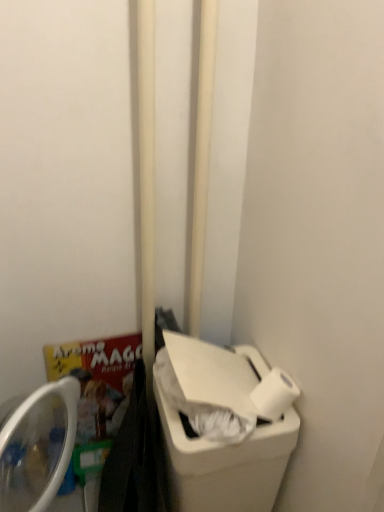
This screenshot has width=384, height=512. Describe the element at coordinates (147, 177) in the screenshot. I see `white smooth pole at center, positioned as the second pole in right-to-left order` at that location.

Consider the image. What is the approximate height of white plastic recycling bin at lower right?

The height of white plastic recycling bin at lower right is 22.57 inches.

Identify the location of white matte toilet paper at lower right. This screenshot has width=384, height=512. (274, 394).

At what (x,y) coordinates should I click in order to perform the action: click on recycling bin that is on the right side of white smooth pole at center, positioned as the second pole in right-to-left order. Please return your answer as a coordinate pair (x, y). The height and width of the screenshot is (512, 384). Looking at the image, I should click on (226, 464).

Who is smaller, white smooth pole at center, positioned as the second pole in right-to-left order, or white plastic recycling bin at lower right?

white smooth pole at center, positioned as the second pole in right-to-left order.

From a real-world perspective, which object rests below the other?

In real-world perspective, white plastic recycling bin at lower right is lower.

Is white smooth pole at center, the first pole in the left-to-right sequence, positioned behind white plastic recycling bin at lower right?

No, white smooth pole at center, the first pole in the left-to-right sequence, is closer to the viewer.

Is white plastic recycling bin at lower right positioned with its back to white smooth pole at center, the first pole in the left-to-right sequence?

No, white smooth pole at center, the first pole in the left-to-right sequence, is not at the back of white plastic recycling bin at lower right.

From the image's perspective, is white plastic recycling bin at lower right under white smooth pole at center, positioned as the second pole in right-to-left order?

Yes, from the image's perspective, white plastic recycling bin at lower right is beneath white smooth pole at center, positioned as the second pole in right-to-left order.

Which object is thinner, white plastic recycling bin at lower right or white smooth pole at center, the first pole in the left-to-right sequence?

Thinner between the two is white smooth pole at center, the first pole in the left-to-right sequence.

From a real-world perspective, is white matte toilet paper at lower right physically located above or below white smooth pole at center, positioned as the second pole in right-to-left order?

Clearly, from a real-world perspective, white matte toilet paper at lower right is below white smooth pole at center, positioned as the second pole in right-to-left order.

From the picture: Is white matte toilet paper at lower right next to white smooth pole at center, the first pole in the left-to-right sequence?

No, white matte toilet paper at lower right is not touching white smooth pole at center, the first pole in the left-to-right sequence.

In terms of width, does white matte toilet paper at lower right look wider or thinner when compared to white smooth pole at center, positioned as the second pole in right-to-left order?

white matte toilet paper at lower right is thinner than white smooth pole at center, positioned as the second pole in right-to-left order.

Consider the image. Can you tell me how much white matte toilet paper at lower right and white smooth pole at center, positioned as the second pole in right-to-left order, differ in facing direction?

white matte toilet paper at lower right and white smooth pole at center, positioned as the second pole in right-to-left order, are facing 90 degrees away from each other.

Which point is more forward, (147, 295) or (194, 334)?

The point (147, 295) is in front.

Where is `pole that is above the white smooth pole at center, positioned as the second pole in right-to-left order (from the image's perspective)`? The width and height of the screenshot is (384, 512). pole that is above the white smooth pole at center, positioned as the second pole in right-to-left order (from the image's perspective) is located at coordinates (202, 158).

Considering the sizes of white smooth pole at center, the first pole in the left-to-right sequence, and white smooth pole at center, marked as the second pole in a left-to-right arrangement, in the image, is white smooth pole at center, the first pole in the left-to-right sequence, bigger or smaller than white smooth pole at center, marked as the second pole in a left-to-right arrangement,?

In the image, white smooth pole at center, the first pole in the left-to-right sequence, appears to be larger than white smooth pole at center, marked as the second pole in a left-to-right arrangement.

Which is nearer, (193, 298) or (150, 78)?

The point (150, 78) is in front.

Based on the photo, is white smooth pole at center, placed as the first pole when sorted from right to left, thinner than white smooth pole at center, positioned as the second pole in right-to-left order?

Yes.

Considering the relative sizes of white smooth pole at center, marked as the second pole in a left-to-right arrangement, and white smooth pole at center, the first pole in the left-to-right sequence, in the image provided, is white smooth pole at center, marked as the second pole in a left-to-right arrangement, taller than white smooth pole at center, the first pole in the left-to-right sequence,?

No.

Is white smooth pole at center, placed as the first pole when sorted from right to left, at the right side of white smooth pole at center, the first pole in the left-to-right sequence?

Yes.

Considering the positions of objects white plastic recycling bin at lower right and white smooth pole at center, marked as the second pole in a left-to-right arrangement, in the image provided, who is behind, white plastic recycling bin at lower right or white smooth pole at center, marked as the second pole in a left-to-right arrangement,?

Positioned behind is white smooth pole at center, marked as the second pole in a left-to-right arrangement.

Is white plastic recycling bin at lower right positioned far away from white smooth pole at center, placed as the first pole when sorted from right to left?

No, white plastic recycling bin at lower right is not far away from white smooth pole at center, placed as the first pole when sorted from right to left.

Locate an element on the screen. This screenshot has width=384, height=512. pole that is the 1st one when counting leftward from the white plastic recycling bin at lower right is located at coordinates [x=202, y=158].

Which object is wider, white matte toilet paper at lower right or white smooth pole at center, marked as the second pole in a left-to-right arrangement?

white matte toilet paper at lower right is wider.

Is white matte toilet paper at lower right bigger than white smooth pole at center, marked as the second pole in a left-to-right arrangement?

No.

Is white matte toilet paper at lower right not close to white smooth pole at center, marked as the second pole in a left-to-right arrangement?

No, there isn't a large distance between white matte toilet paper at lower right and white smooth pole at center, marked as the second pole in a left-to-right arrangement.

This screenshot has height=512, width=384. Identify the location of the 2nd pole to the left of the white plastic recycling bin at lower right, counting from the anchor's position. (147, 177).

Where is `recycling bin below the white smooth pole at center, the first pole in the left-to-right sequence (from the image's perspective)`? Image resolution: width=384 pixels, height=512 pixels. recycling bin below the white smooth pole at center, the first pole in the left-to-right sequence (from the image's perspective) is located at coordinates (226, 464).

Based on their spatial positions, is white smooth pole at center, positioned as the second pole in right-to-left order, or white matte toilet paper at lower right closer to white plastic recycling bin at lower right?

The object closer to white plastic recycling bin at lower right is white matte toilet paper at lower right.

Looking at the image, which one is located closer to white smooth pole at center, positioned as the second pole in right-to-left order, white matte toilet paper at lower right or white plastic recycling bin at lower right?

The object closer to white smooth pole at center, positioned as the second pole in right-to-left order, is white plastic recycling bin at lower right.

When comparing their distances from white smooth pole at center, placed as the first pole when sorted from right to left, does white plastic recycling bin at lower right or white matte toilet paper at lower right seem closer?

white plastic recycling bin at lower right is positioned closer to the anchor white smooth pole at center, placed as the first pole when sorted from right to left.

Considering their positions, is white smooth pole at center, marked as the second pole in a left-to-right arrangement, positioned further to white smooth pole at center, positioned as the second pole in right-to-left order, than white matte toilet paper at lower right?

white matte toilet paper at lower right is further to white smooth pole at center, positioned as the second pole in right-to-left order.

When comparing their distances from white plastic recycling bin at lower right, does white smooth pole at center, placed as the first pole when sorted from right to left, or white matte toilet paper at lower right seem further?

white smooth pole at center, placed as the first pole when sorted from right to left, lies further to white plastic recycling bin at lower right than the other object.

Based on the photo, considering their positions, is white smooth pole at center, placed as the first pole when sorted from right to left, positioned closer to white plastic recycling bin at lower right than white smooth pole at center, positioned as the second pole in right-to-left order?

white smooth pole at center, positioned as the second pole in right-to-left order, is closer to white plastic recycling bin at lower right.

Which object lies nearer to the anchor point white smooth pole at center, marked as the second pole in a left-to-right arrangement, white smooth pole at center, the first pole in the left-to-right sequence, or white matte toilet paper at lower right?

Among the two, white smooth pole at center, the first pole in the left-to-right sequence, is located nearer to white smooth pole at center, marked as the second pole in a left-to-right arrangement.

Considering their positions, is white smooth pole at center, positioned as the second pole in right-to-left order, positioned closer to white matte toilet paper at lower right than white smooth pole at center, placed as the first pole when sorted from right to left?

white smooth pole at center, positioned as the second pole in right-to-left order, lies closer to white matte toilet paper at lower right than the other object.

Locate an element on the screen. The image size is (384, 512). pole between white smooth pole at center, marked as the second pole in a left-to-right arrangement, and white plastic recycling bin at lower right from top to bottom is located at coordinates (147, 177).

The width and height of the screenshot is (384, 512). I want to click on toilet paper that lies between white smooth pole at center, placed as the first pole when sorted from right to left, and white plastic recycling bin at lower right from top to bottom, so (x=274, y=394).

This screenshot has height=512, width=384. I want to click on toilet paper that lies between white smooth pole at center, the first pole in the left-to-right sequence, and white plastic recycling bin at lower right from top to bottom, so click(274, 394).

Find the location of a particular element. This screenshot has height=512, width=384. pole between white smooth pole at center, placed as the first pole when sorted from right to left, and white matte toilet paper at lower right, in the vertical direction is located at coordinates (147, 177).